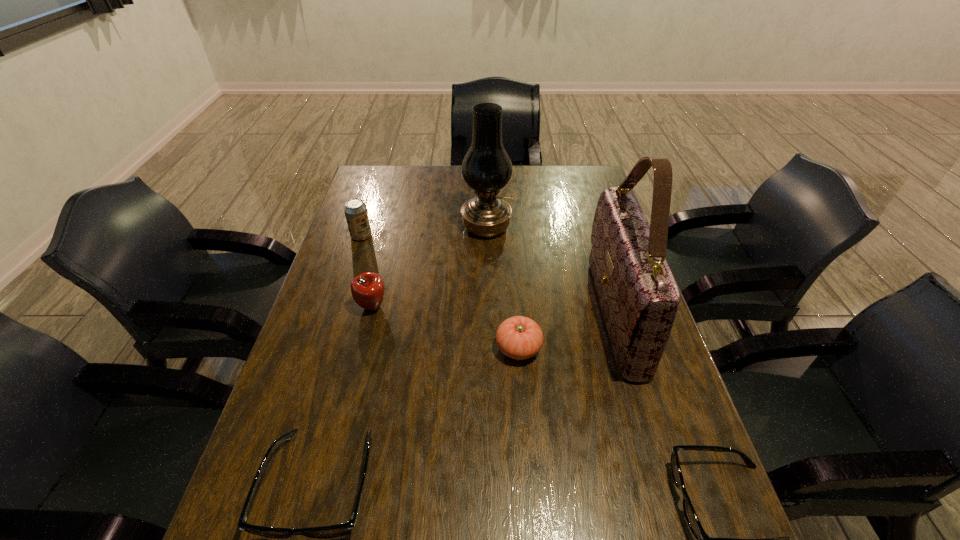
If the aim is uniform spacing by inserting an additional spectacles among them, please point to a vacant space for this new spectacles. Please provide its 2D coordinates. Your answer should be formatted as a tuple, i.e. [(x, y)], where the tuple contains the x and y coordinates of a point satisfying the conditions above.

[(518, 492)]